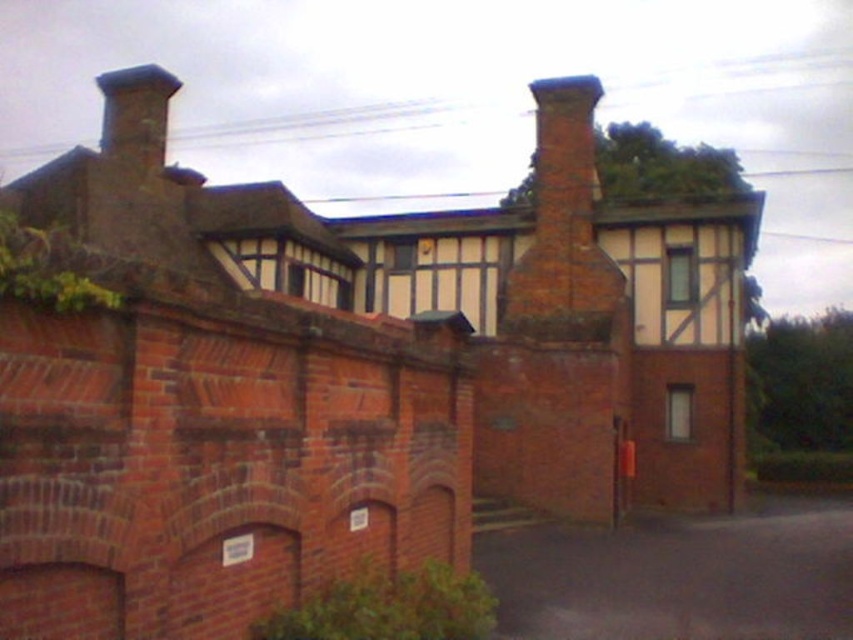
Can you confirm if red brick chimney at upper center is wider than green leafy ivy at lower center?

Yes, red brick chimney at upper center is wider than green leafy ivy at lower center.

You are a GUI agent. You are given a task and a screenshot of the screen. Output one action in this format:
    pyautogui.click(x=<x>, y=<y>)
    Task: Click on the red brick chimney at upper center
    This screenshot has width=853, height=640.
    Given the screenshot: What is the action you would take?
    pyautogui.click(x=563, y=227)

The height and width of the screenshot is (640, 853). I want to click on red brick chimney at upper center, so click(563, 227).

Is green leafy ivy at upper left closer to the viewer compared to smooth brick chimney at upper left?

Yes, it is in front of smooth brick chimney at upper left.

Image resolution: width=853 pixels, height=640 pixels. What do you see at coordinates (47, 269) in the screenshot?
I see `green leafy ivy at upper left` at bounding box center [47, 269].

Where is `green leafy ivy at upper left`? green leafy ivy at upper left is located at coordinates [x=47, y=269].

Is green leafy ivy at lower center thinner than green leafy ivy at upper left?

In fact, green leafy ivy at lower center might be wider than green leafy ivy at upper left.

Is green leafy ivy at lower center wider than green leafy ivy at upper left?

Indeed, green leafy ivy at lower center has a greater width compared to green leafy ivy at upper left.

Does point (433, 605) come closer to viewer compared to point (20, 266)?

No, it is not.

You are a GUI agent. You are given a task and a screenshot of the screen. Output one action in this format:
    pyautogui.click(x=<x>, y=<y>)
    Task: Click on the green leafy ivy at lower center
    Image resolution: width=853 pixels, height=640 pixels.
    Given the screenshot: What is the action you would take?
    pyautogui.click(x=389, y=605)